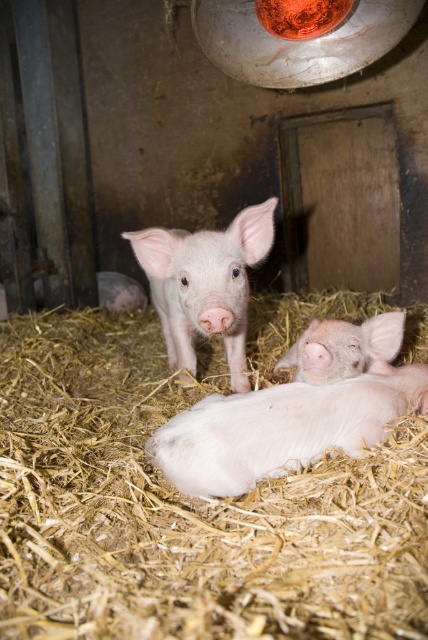
You are a farmer checking the pigsty. You see the light brown straw at center and the pink smooth piglet at center. Which object is closer to you?

The light brown straw at center is closer to you because it is in front of the pink smooth piglet at center.

What is the color of the material located at the coordinates point (184, 508) in the image?

The point (184, 508) indicates light brown straw at center.